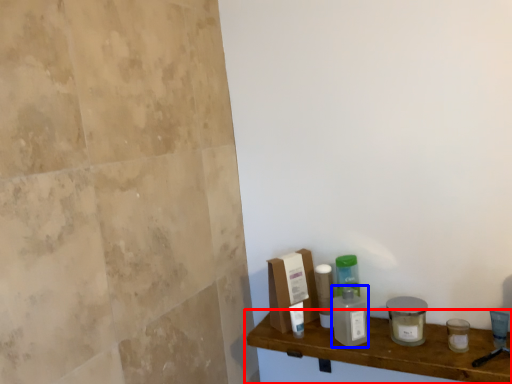
Question: Which of the following is the closest to the observer, shelf (highlighted by a red box) or cleaning product (highlighted by a blue box)?

Choices:
 (A) shelf
 (B) cleaning product

Answer: (A)